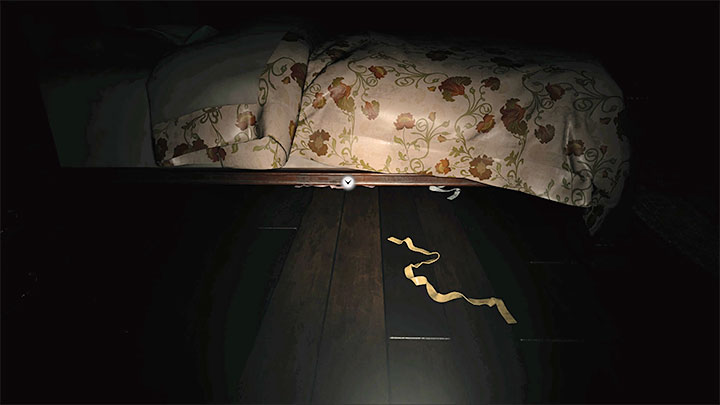
Image resolution: width=720 pixels, height=405 pixels. In order to click on underneath bed in this screenshot , I will do `click(307, 196)`.